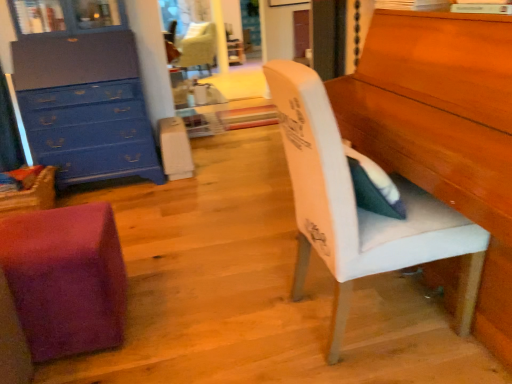
Locate an element on the screen. empty space that is in between white fabric chair at right, arranged as the second chair when viewed from the top, and purple fuzzy cube at lower left, which ranks as the first chair in bottom-to-top order is located at coordinates (200, 322).